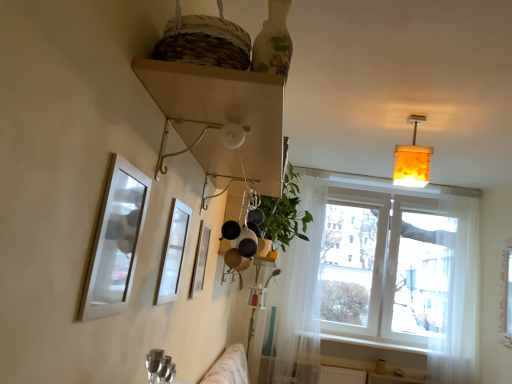
Question: Choose the correct answer: Is translucent amber glass lampshade at upper right inside wooden shelf at upper center or outside it?

Choices:
 (A) inside
 (B) outside

Answer: (B)

Question: Considering the positions of point (402, 145) and point (239, 170), is point (402, 145) closer or farther from the camera than point (239, 170)?

Choices:
 (A) closer
 (B) farther

Answer: (B)

Question: Estimate the real-world distances between objects in this image. Which object is farther from the metallic silver picture frame at center, the third picture frame from the front?

Choices:
 (A) matte white picture frame at left, arranged as the 1th picture frame when viewed from the front
 (B) transparent fabric at right
 (C) translucent amber glass lampshade at upper right
 (D) white sheer curtain at right, placed as the 1th curtain when sorted from right to left
 (E) green leafy plant at center

Answer: (D)

Question: Which object is positioned farthest from the wooden shelf at upper center?

Choices:
 (A) translucent white curtain at center, the 1th curtain viewed from the left
 (B) metallic silver picture frame at center, the third picture frame from the front
 (C) transparent fabric at right
 (D) green leafy plant at center
 (E) white glossy picture frame at upper center, acting as the 2th picture frame starting from the front

Answer: (C)